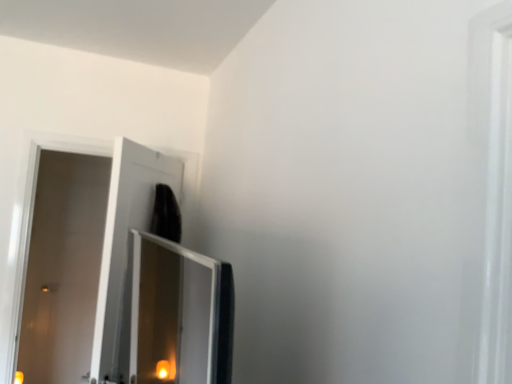
Question: Visually, is white glossy door at left positioned to the left or to the right of transparent glass screen door at upper left?

Choices:
 (A) right
 (B) left

Answer: (B)

Question: Is point (65, 200) positioned closer to the camera than point (105, 243)?

Choices:
 (A) closer
 (B) farther

Answer: (B)

Question: Considering the positions of white glossy door at left and transparent glass screen door at upper left in the image, is white glossy door at left wider or thinner than transparent glass screen door at upper left?

Choices:
 (A) wide
 (B) thin

Answer: (B)

Question: From their relative heights in the image, would you say transparent glass screen door at upper left is taller or shorter than white glossy door at left?

Choices:
 (A) short
 (B) tall

Answer: (A)

Question: Is point (151, 157) positioned closer to the camera than point (65, 291)?

Choices:
 (A) farther
 (B) closer

Answer: (B)

Question: Is transparent glass screen door at upper left spatially inside white glossy door at left, or outside of it?

Choices:
 (A) outside
 (B) inside

Answer: (A)

Question: Considering the relative positions of transparent glass screen door at upper left and white glossy door at left in the image provided, is transparent glass screen door at upper left to the left or to the right of white glossy door at left?

Choices:
 (A) right
 (B) left

Answer: (A)